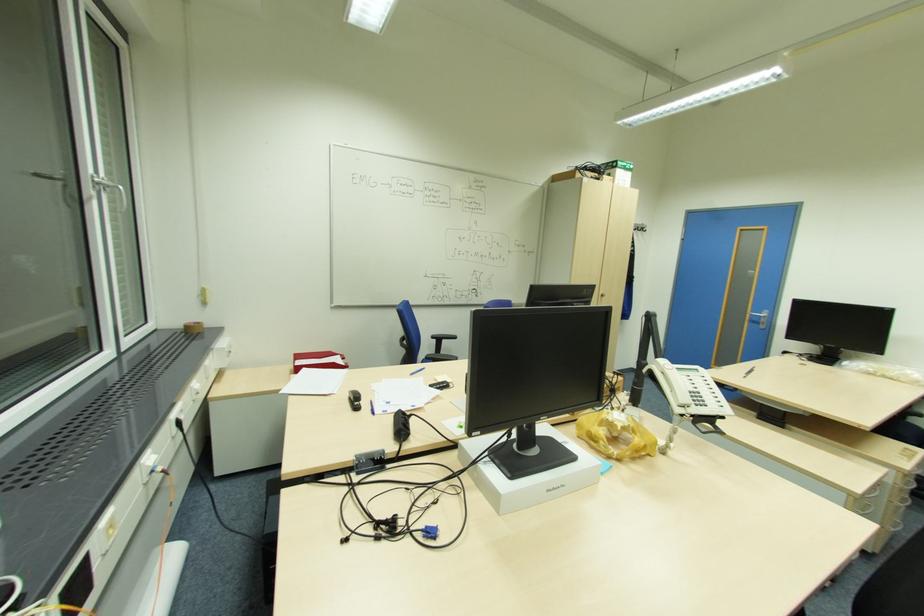
At what (x,y) coordinates should I click in order to perform the action: click on black office stapler. Please return your answer as a coordinate pair (x, y). This screenshot has width=924, height=616. Looking at the image, I should click on (354, 400).